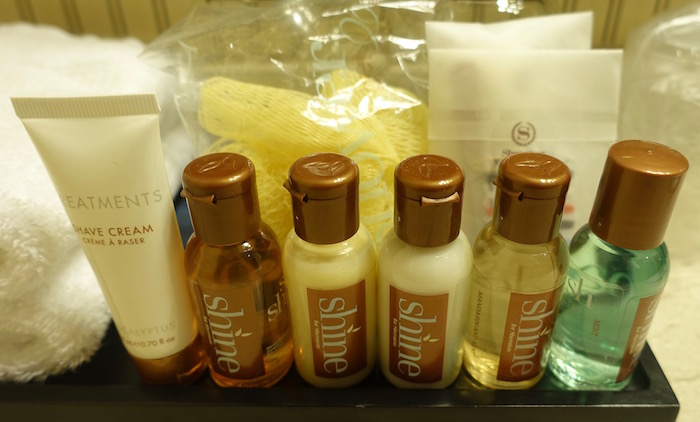
This screenshot has height=422, width=700. What are the coordinates of `towel` in the screenshot? It's located at (21, 264), (52, 323).